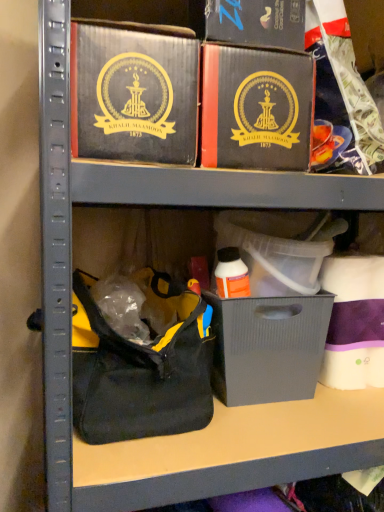
Question: From the image's perspective, is matte black box at upper center, the second box in the right-to-left sequence, located above or below matte black box at center, marked as the 2th box in a left-to-right arrangement?

Choices:
 (A) below
 (B) above

Answer: (B)

Question: From a real-world perspective, is matte black box at upper center, which is counted as the 1th box, starting from the left, positioned above or below matte black box at center, arranged as the 1th box when viewed from the right?

Choices:
 (A) below
 (B) above

Answer: (B)

Question: Which of these objects is positioned closest to the matte gray plastic bin at center?

Choices:
 (A) matte black box at upper center, which is counted as the 1th box, starting from the left
 (B) black fabric handbag at lower left
 (C) matte black box at upper center
 (D) matte black box at center, arranged as the 1th box when viewed from the right

Answer: (B)

Question: Which object is the closest to the matte gray plastic bin at center?

Choices:
 (A) matte black box at center, marked as the 2th box in a left-to-right arrangement
 (B) matte black box at upper center
 (C) black fabric handbag at lower left
 (D) matte black box at upper center, which is counted as the 1th box, starting from the left

Answer: (C)